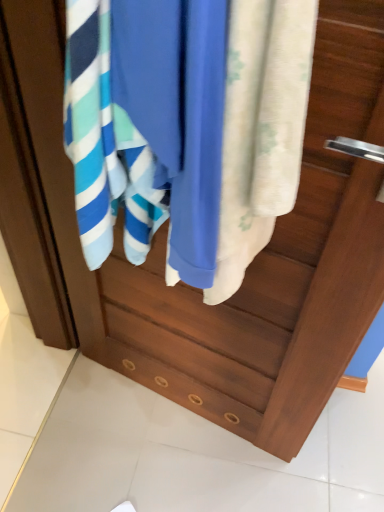
Question: In terms of size, does silky white towel at center appear bigger or smaller than blue cotton towel at center?

Choices:
 (A) small
 (B) big

Answer: (A)

Question: Considering the positions of point (251, 175) and point (241, 263), is point (251, 175) closer or farther from the camera than point (241, 263)?

Choices:
 (A) farther
 (B) closer

Answer: (B)

Question: Based on their positions, is silky white towel at center located to the left or right of blue cotton towel at center?

Choices:
 (A) right
 (B) left

Answer: (A)

Question: Visually, is blue cotton towel at center positioned to the left or to the right of silky white towel at center?

Choices:
 (A) right
 (B) left

Answer: (B)

Question: From a real-world perspective, relative to silky white towel at center, is blue cotton towel at center vertically above or below?

Choices:
 (A) above
 (B) below

Answer: (A)

Question: Is point (210, 284) positioned closer to the camera than point (314, 5)?

Choices:
 (A) farther
 (B) closer

Answer: (A)

Question: From the image's perspective, is blue cotton towel at center located above or below silky white towel at center?

Choices:
 (A) below
 (B) above

Answer: (B)